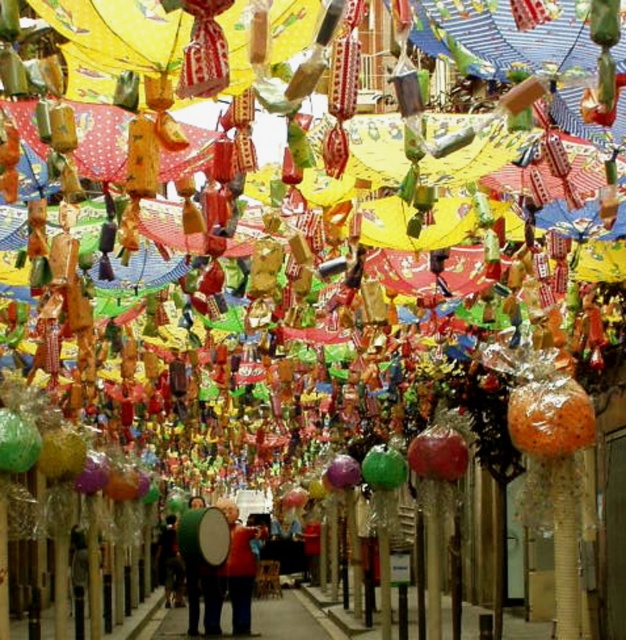
Which of these two, green matte drum at center or dark brown leather jacket at lower left, stands taller?

green matte drum at center is taller.

You are a GUI agent. You are given a task and a screenshot of the screen. Output one action in this format:
    pyautogui.click(x=<x>, y=<y>)
    Task: Click on the green matte drum at center
    
    Given the screenshot: What is the action you would take?
    pyautogui.click(x=202, y=564)

Between point (202, 572) and point (168, 593), which one is positioned in front?

Point (202, 572)

Where is `green matte drum at center`? This screenshot has height=640, width=626. green matte drum at center is located at coordinates (202, 564).

Looking at this image, can you confirm if green matte drum at center is shorter than red fabric jacket at center?

No, green matte drum at center is not shorter than red fabric jacket at center.

Where is `green matte drum at center`? The image size is (626, 640). green matte drum at center is located at coordinates (202, 564).

In order to click on green matte drum at center in this screenshot , I will do `click(202, 564)`.

Is red fabric jacket at center wider than dark brown leather jacket at lower left?

Correct, the width of red fabric jacket at center exceeds that of dark brown leather jacket at lower left.

Between point (249, 609) and point (163, 524), which one is positioned in front?

Point (249, 609) is more forward.

Is point (233, 509) less distant than point (170, 556)?

That is True.

I want to click on red fabric jacket at center, so click(239, 566).